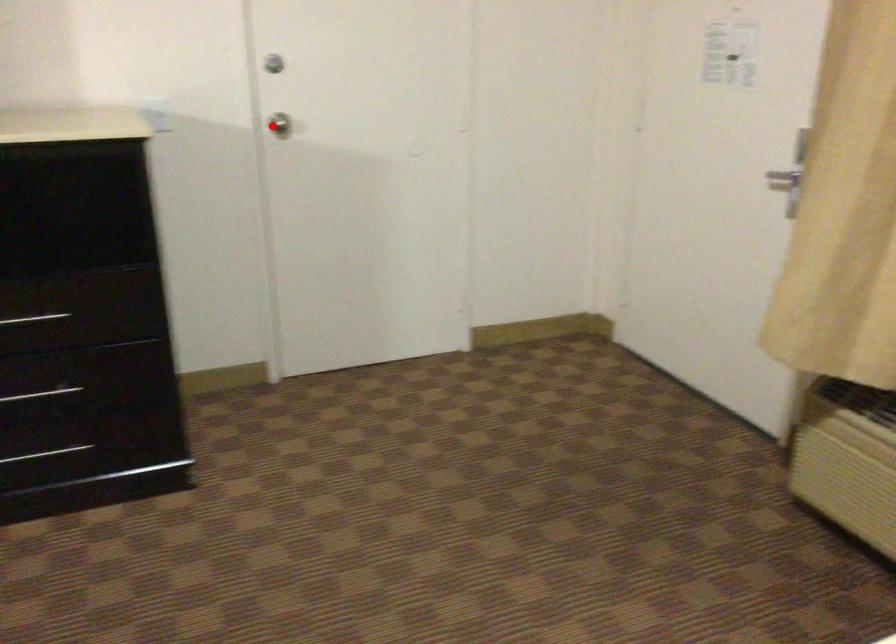
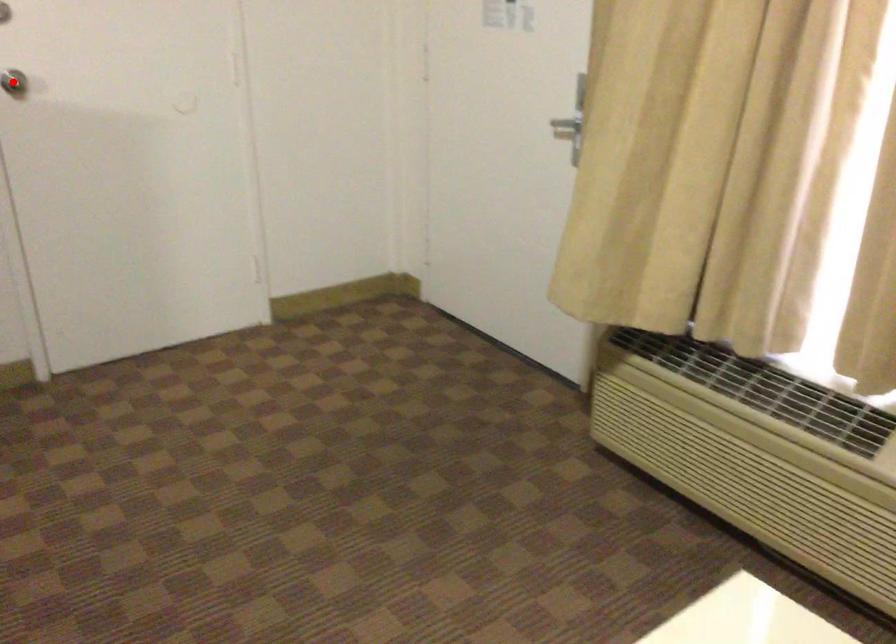
I am providing you with two images of the same scene from different viewpoints. A red point is marked on the first image and another point is marked on the second image. Does the point marked in image1 correspond to the same location as the one in image2?

Yes